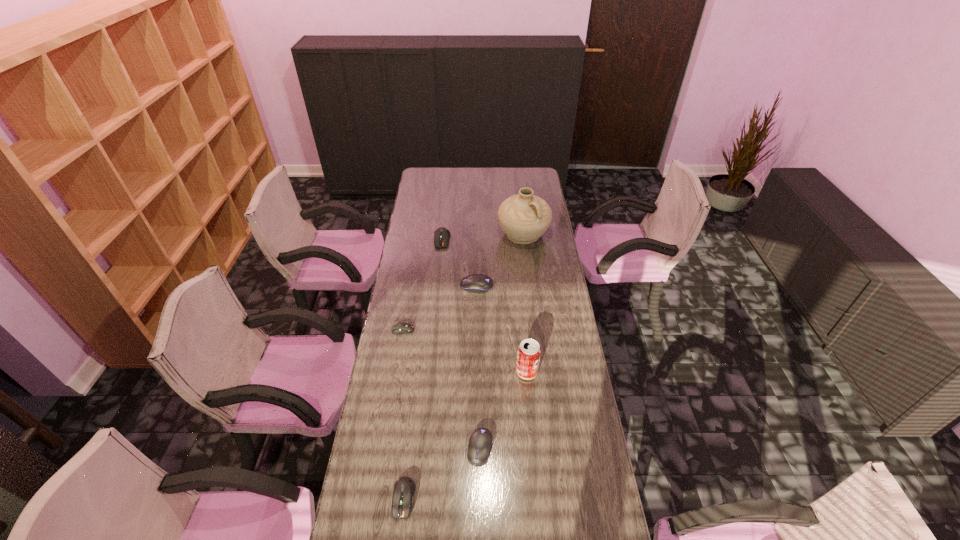
This screenshot has width=960, height=540. Identify the location of vacant area that lies between the bigger black computer mouse and the farthest computer equipment. (459, 263).

Select which object appears as the fourth closest to the fourth nearest object. Please provide its 2D coordinates. Your answer should be formatted as a tuple, i.e. [(x, y)], where the tuple contains the x and y coordinates of a point satisfying the conditions above.

[(441, 236)]

Choose which object is the fourth nearest neighbor to the soda can. Please provide its 2D coordinates. Your answer should be formatted as a tuple, i.e. [(x, y)], where the tuple contains the x and y coordinates of a point satisfying the conditions above.

[(404, 488)]

Select which computer equipment appears as the third closest to the nearest object. Please provide its 2D coordinates. Your answer should be formatted as a tuple, i.e. [(x, y)], where the tuple contains the x and y coordinates of a point satisfying the conditions above.

[(478, 283)]

Image resolution: width=960 pixels, height=540 pixels. What are the coordinates of `the fourth closest computer equipment to the pottery` in the screenshot? It's located at (480, 442).

Find the location of a particular element. dark computer equipment that is the third closest to the third farthest object is located at coordinates click(404, 488).

Where is `dark computer equipment that can be found as the closest to the second smallest dark computer equipment`? This screenshot has width=960, height=540. dark computer equipment that can be found as the closest to the second smallest dark computer equipment is located at coordinates (400, 328).

Select which black computer mouse is the closest to the shortest computer equipment. Please provide its 2D coordinates. Your answer should be formatted as a tuple, i.e. [(x, y)], where the tuple contains the x and y coordinates of a point satisfying the conditions above.

[(478, 283)]

At what (x,y) coordinates should I click in order to perform the action: click on black computer mouse that stands as the second closest to the second biggest dark computer equipment. Please return your answer as a coordinate pair (x, y). Looking at the image, I should click on (478, 283).

Find the location of a particular element. The width and height of the screenshot is (960, 540). vacant space that satisfies the following two spatial constraints: 1. on the button of the smallest dark computer equipment; 2. on the back side of the sixth farthest object is located at coordinates (383, 448).